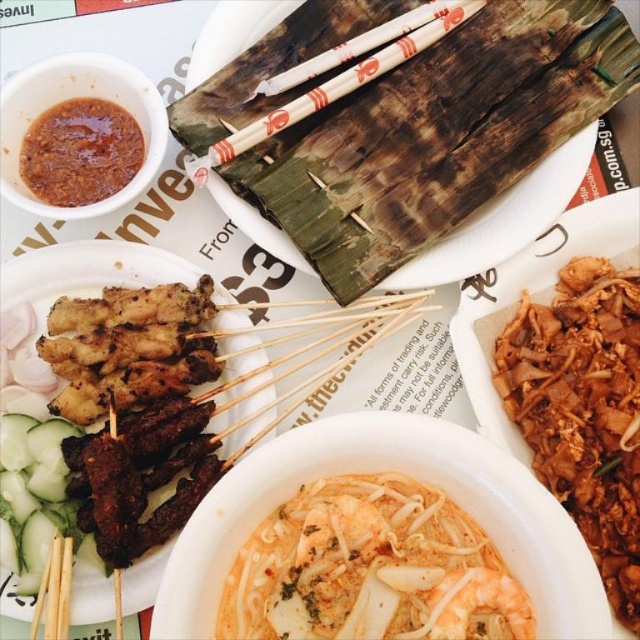
Question: Does grilled meat at left have a smaller size compared to wooden skewers at center?

Choices:
 (A) yes
 (B) no

Answer: (A)

Question: Is shiny orange noodles at center closer to the viewer compared to white wood chopsticks at center?

Choices:
 (A) no
 (B) yes

Answer: (B)

Question: Which is nearer to the smooth brown paste at upper left?

Choices:
 (A) grilled meat at left
 (B) wooden chopsticks at center
 (C) shiny orange noodles at center

Answer: (A)

Question: Is matte brown sauce at upper left to the right of wooden chopsticks at center from the viewer's perspective?

Choices:
 (A) no
 (B) yes

Answer: (A)

Question: Which point is farther to the camera?

Choices:
 (A) white wood chopsticks at center
 (B) matte brown sauce at upper left
 (C) brown crispy noodles at right

Answer: (A)

Question: Which point appears closest to the camera in this image?

Choices:
 (A) (61, 612)
 (B) (122, 124)
 (C) (12, 88)
 (D) (86, 369)

Answer: (A)